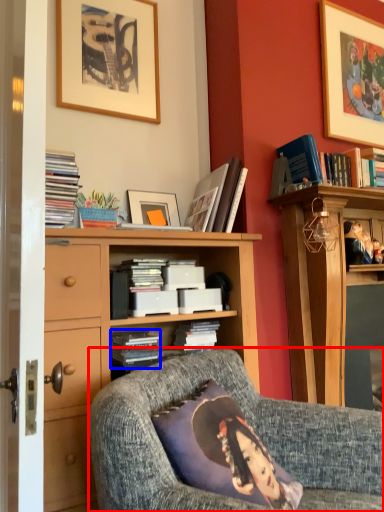
Question: Which of the following is the closest to the observer, chair (highlighted by a red box) or book (highlighted by a blue box)?

Choices:
 (A) chair
 (B) book

Answer: (A)